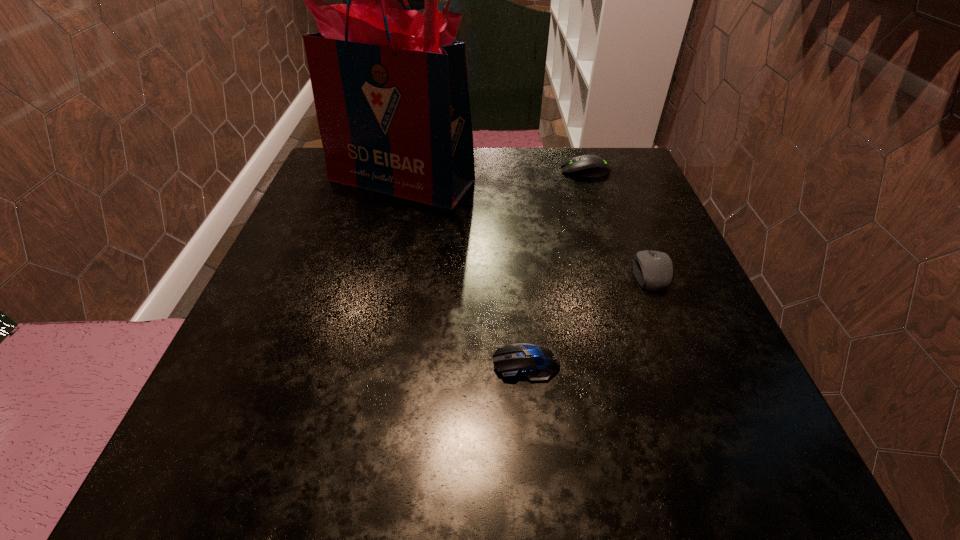
At what (x,y) coordinates should I click in order to perform the action: click on the leftmost object. Please return your answer as a coordinate pair (x, y). Image resolution: width=960 pixels, height=540 pixels. Looking at the image, I should click on (390, 87).

Image resolution: width=960 pixels, height=540 pixels. What are the coordinates of `the tallest object` in the screenshot? It's located at (390, 87).

Locate an element on the screen. The height and width of the screenshot is (540, 960). the farthest computer mouse is located at coordinates (587, 166).

Where is `the second nearest computer mouse`? the second nearest computer mouse is located at coordinates (654, 271).

Locate an element on the screen. This screenshot has width=960, height=540. the nearest computer mouse is located at coordinates point(534,363).

Identify the location of the third object from right to left. (534, 363).

Locate an element on the screen. blank space located on the front-facing side of the grocery bag is located at coordinates (366, 328).

The width and height of the screenshot is (960, 540). Find the location of `free space located 0.160m on the wheel side of the farthest computer mouse`. free space located 0.160m on the wheel side of the farthest computer mouse is located at coordinates (492, 171).

Find the location of `vacant space situated on the wheel side of the farthest computer mouse`. vacant space situated on the wheel side of the farthest computer mouse is located at coordinates click(x=446, y=171).

Where is `blank area located 0.280m on the wheel side of the farthest computer mouse`? The image size is (960, 540). blank area located 0.280m on the wheel side of the farthest computer mouse is located at coordinates coord(443,171).